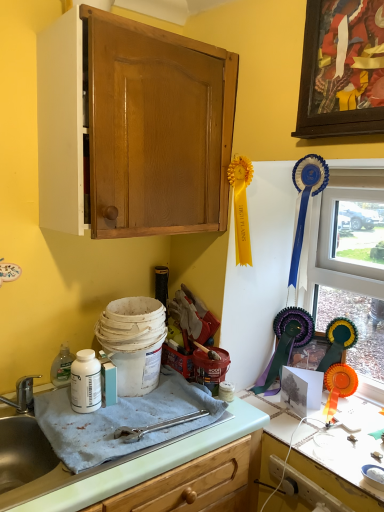
Question: Does white matte bottle at lower left appear on the right side of matte wood cabinet at upper left?

Choices:
 (A) no
 (B) yes

Answer: (A)

Question: From the image's perspective, is white matte bottle at lower left on top of matte wood cabinet at upper left?

Choices:
 (A) yes
 (B) no

Answer: (B)

Question: From the image's perspective, is white matte bottle at lower left located beneath matte wood cabinet at upper left?

Choices:
 (A) no
 (B) yes

Answer: (B)

Question: Does white matte bottle at lower left have a lesser width compared to matte wood cabinet at upper left?

Choices:
 (A) yes
 (B) no

Answer: (A)

Question: Is white matte bottle at lower left smaller than matte wood cabinet at upper left?

Choices:
 (A) yes
 (B) no

Answer: (A)

Question: From a real-world perspective, is white matte bottle at lower left on top of matte wood cabinet at upper left?

Choices:
 (A) no
 (B) yes

Answer: (A)

Question: Is light green laminate countertop at lower center, marked as the 1th countertop in a left-to-right arrangement, to the left of wooden picture frame at upper right from the viewer's perspective?

Choices:
 (A) yes
 (B) no

Answer: (A)

Question: From a real-world perspective, is light green laminate countertop at lower center, which appears as the second countertop when viewed from the right, located higher than wooden picture frame at upper right?

Choices:
 (A) yes
 (B) no

Answer: (B)

Question: From a real-world perspective, is light green laminate countertop at lower center, which appears as the second countertop when viewed from the right, under wooden picture frame at upper right?

Choices:
 (A) no
 (B) yes

Answer: (B)

Question: Can you confirm if light green laminate countertop at lower center, marked as the 1th countertop in a left-to-right arrangement, is taller than wooden picture frame at upper right?

Choices:
 (A) no
 (B) yes

Answer: (A)

Question: Is the position of light green laminate countertop at lower center, which appears as the second countertop when viewed from the right, less distant than that of wooden picture frame at upper right?

Choices:
 (A) no
 (B) yes

Answer: (B)

Question: Considering the relative sizes of light green laminate countertop at lower center, which appears as the second countertop when viewed from the right, and wooden picture frame at upper right in the image provided, is light green laminate countertop at lower center, which appears as the second countertop when viewed from the right, thinner than wooden picture frame at upper right?

Choices:
 (A) yes
 (B) no

Answer: (B)

Question: Is white glossy countertop at lower right, which appears as the second countertop when viewed from the left, positioned with its back to wooden picture frame at upper right?

Choices:
 (A) yes
 (B) no

Answer: (B)